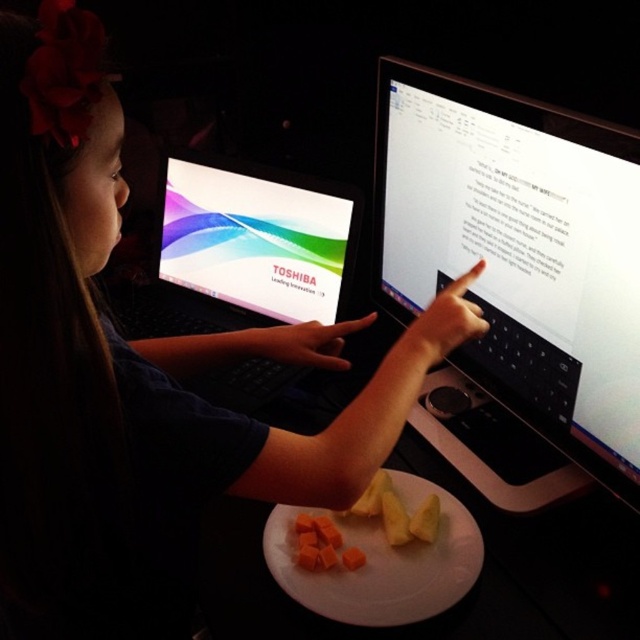
Can you confirm if matte black monitor at center is smaller than shiny plastic laptop at center?

Actually, matte black monitor at center might be larger than shiny plastic laptop at center.

Which is in front, point (413, 234) or point (193, 188)?

Point (413, 234)

Where is `matte black monitor at center`? Image resolution: width=640 pixels, height=640 pixels. matte black monitor at center is located at coordinates (516, 278).

Does shiny plastic laptop at center appear on the right side of white matte plate at center?

Incorrect, shiny plastic laptop at center is not on the right side of white matte plate at center.

Which is in front, point (298, 307) or point (355, 620)?

Point (355, 620) is more forward.

Image resolution: width=640 pixels, height=640 pixels. I want to click on shiny plastic laptop at center, so click(x=253, y=241).

Locate an element on the screen. The image size is (640, 640). shiny plastic laptop at center is located at coordinates (253, 241).

Does point (180, 296) come behind point (428, 525)?

Yes, point (180, 296) is behind point (428, 525).

Is black plastic laptop at center to the right of yellow matte pineapple at center from the viewer's perspective?

Incorrect, black plastic laptop at center is not on the right side of yellow matte pineapple at center.

What do you see at coordinates (240, 250) in the screenshot?
I see `black plastic laptop at center` at bounding box center [240, 250].

Find the location of `black plastic laptop at center`. black plastic laptop at center is located at coordinates (240, 250).